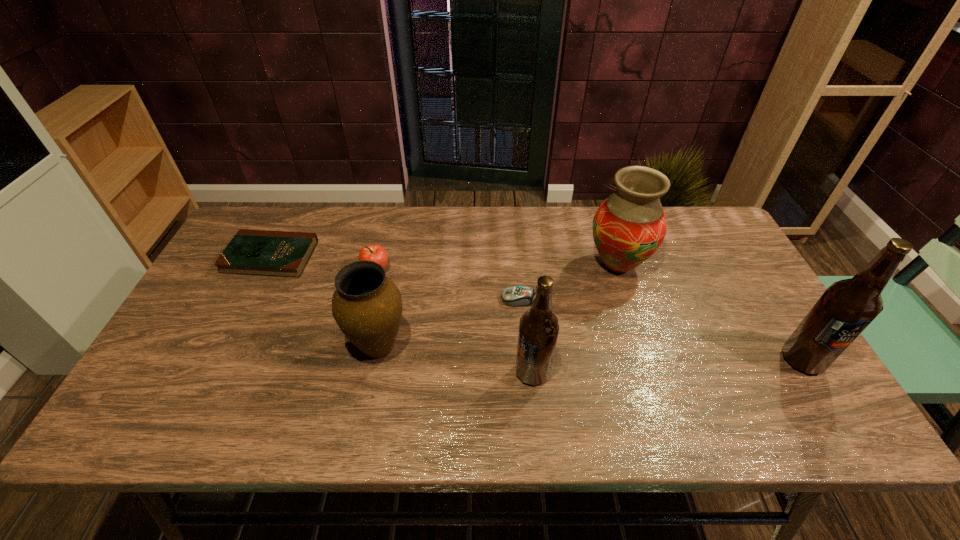
Where is `vacant space located on the label of the shorter beer bottle`? vacant space located on the label of the shorter beer bottle is located at coordinates (423, 373).

At what (x,y) coordinates should I click in order to perform the action: click on free space located on the label of the taller beer bottle. Please return your answer as a coordinate pair (x, y). Looking at the image, I should click on (825, 396).

You are a GUI agent. You are given a task and a screenshot of the screen. Output one action in this format:
    pyautogui.click(x=<x>, y=<y>)
    Task: Click on the vacant space located on the back of the apple
    The height and width of the screenshot is (540, 960).
    Given the screenshot: What is the action you would take?
    pyautogui.click(x=392, y=208)

In order to click on vacant space located on the left of the second object from right to left in this screenshot , I will do `click(528, 265)`.

You are a GUI agent. You are given a task and a screenshot of the screen. Output one action in this format:
    pyautogui.click(x=<x>, y=<y>)
    Task: Click on the vacant space situated 0.380m on the front of the leftmost object
    This screenshot has width=960, height=540.
    Given the screenshot: What is the action you would take?
    pyautogui.click(x=202, y=396)

The height and width of the screenshot is (540, 960). I want to click on free space located on the back of the fourth shortest object, so click(x=392, y=282).

I want to click on free spot located 0.330m on the wheel side of the computer mouse, so click(382, 299).

The width and height of the screenshot is (960, 540). What are the coordinates of `free point located on the wheel side of the computer mouse` in the screenshot? It's located at [x=468, y=299].

Find the location of `free spot located 0.300m on the wheel side of the computer mouse`. free spot located 0.300m on the wheel side of the computer mouse is located at coordinates (393, 299).

This screenshot has width=960, height=540. What are the coordinates of `vase that is at the far edge` in the screenshot? It's located at (629, 226).